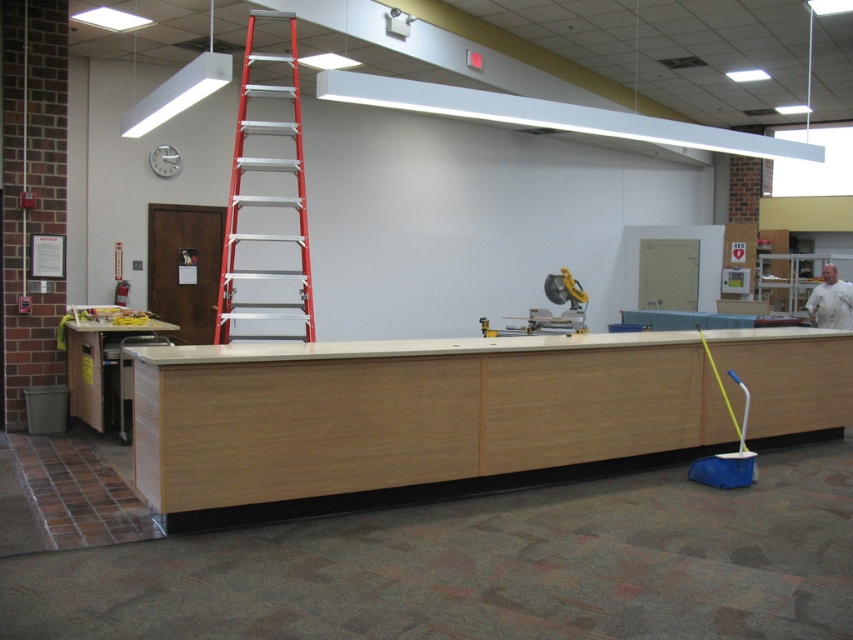
Question: Does light wood counter at center appear on the left side of wooden cabinet at lower left?

Choices:
 (A) no
 (B) yes

Answer: (A)

Question: Which of the following is the closest to the observer?

Choices:
 (A) (294, 22)
 (B) (187, 364)
 (C) (76, 372)

Answer: (B)

Question: In this image, where is light wood counter at center located relative to wooden cabinet at lower left?

Choices:
 (A) above
 (B) below

Answer: (B)

Question: Which object is farther from the camera taking this photo?

Choices:
 (A) light wood counter at center
 (B) wooden cabinet at lower left

Answer: (B)

Question: Which of the following is the farthest from the observer?

Choices:
 (A) light wood counter at center
 (B) wooden cabinet at lower left

Answer: (B)

Question: Is light wood counter at center to the left of red aluminum ladder at upper center from the viewer's perspective?

Choices:
 (A) yes
 (B) no

Answer: (B)